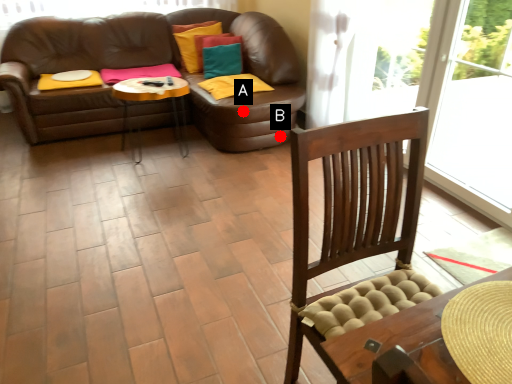
Question: Two points are circled on the image, labeled by A and B beside each circle. Which of the following is the closest to the observer?

Choices:
 (A) A is closer
 (B) B is closer

Answer: (A)